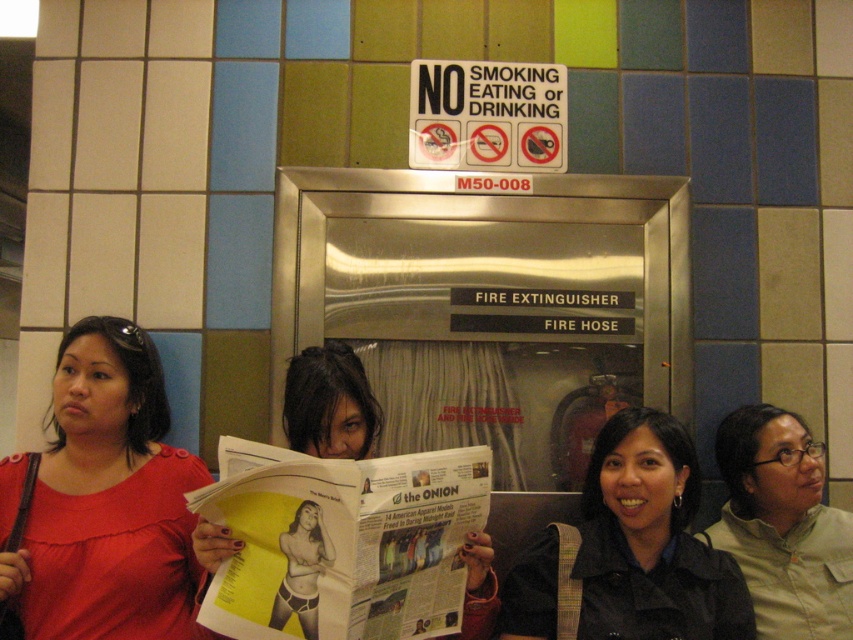
You are a security guard at the subway station and need to locate the person wearing the matte red blouse at left. According to the coordinates provided, where exactly is this person positioned?

The matte red blouse at left is located at point [107,499].

You are a delivery person who needs to place a 28 inch wide package between the matte red blouse at left and the black matte jacket at lower right. Can the package fit in the space between them?

The distance between the matte red blouse at left and the black matte jacket at lower right is 30.63 inches. Since the package is 28 inches wide, it can fit in the space between them as there is enough room.